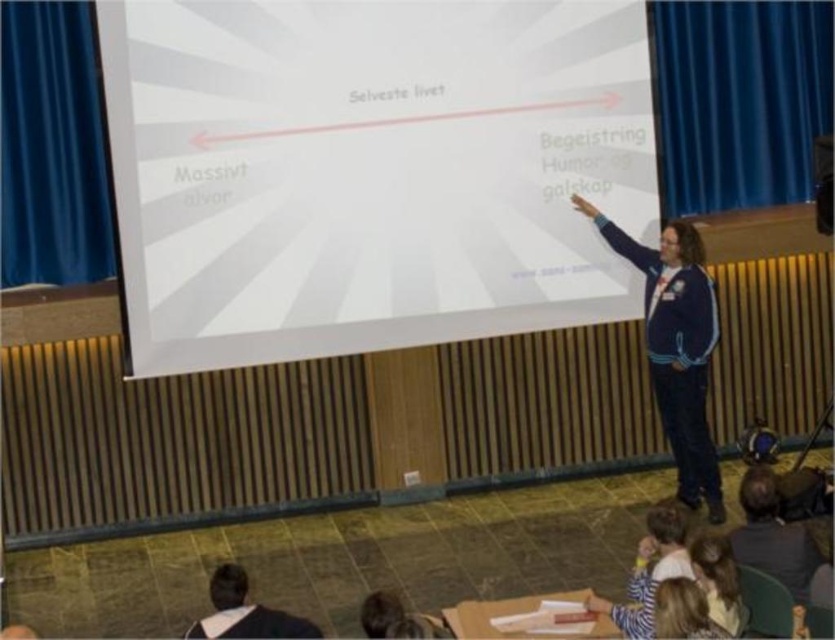
Question: Estimate the real-world distances between objects in this image. Which object is closer to the black fabric shirt at lower left?

Choices:
 (A) dark gray sweater at lower right
 (B) dark blue fleece jacket at right
 (C) white matte projection screen at center

Answer: (C)

Question: Does dark blue fleece jacket at right appear on the left side of light brown hair at lower right?

Choices:
 (A) no
 (B) yes

Answer: (A)

Question: Is white matte projection screen at center further to the viewer compared to black fabric shirt at lower left?

Choices:
 (A) yes
 (B) no

Answer: (A)

Question: Among these points, which one is farthest from the camera?

Choices:
 (A) (529, 220)
 (B) (244, 621)
 (C) (724, 540)

Answer: (A)

Question: Which of the following is the farthest from the observer?

Choices:
 (A) (306, 634)
 (B) (709, 570)
 (C) (691, 417)

Answer: (C)

Question: Is dark blue fleece jacket at right further to camera compared to light brown hair at lower right?

Choices:
 (A) no
 (B) yes

Answer: (B)